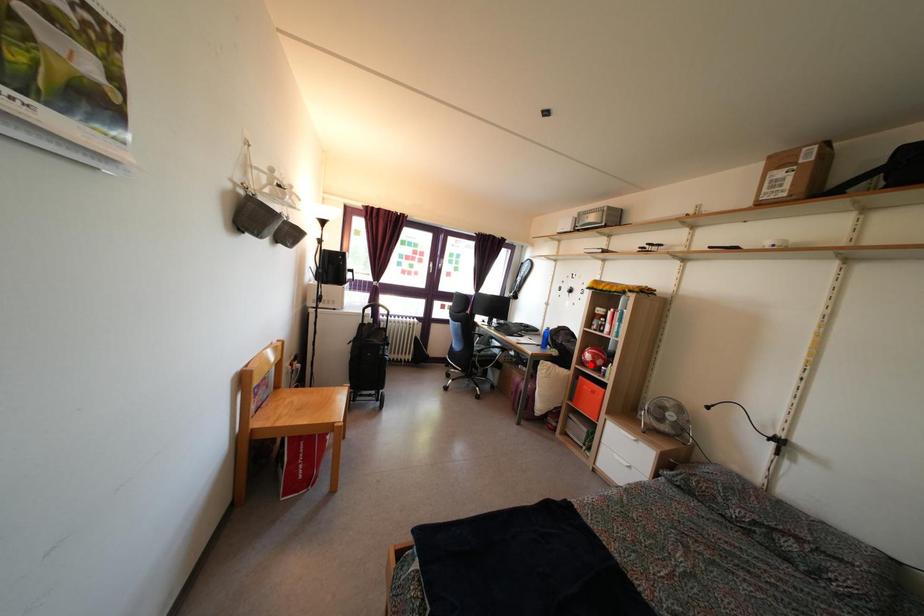
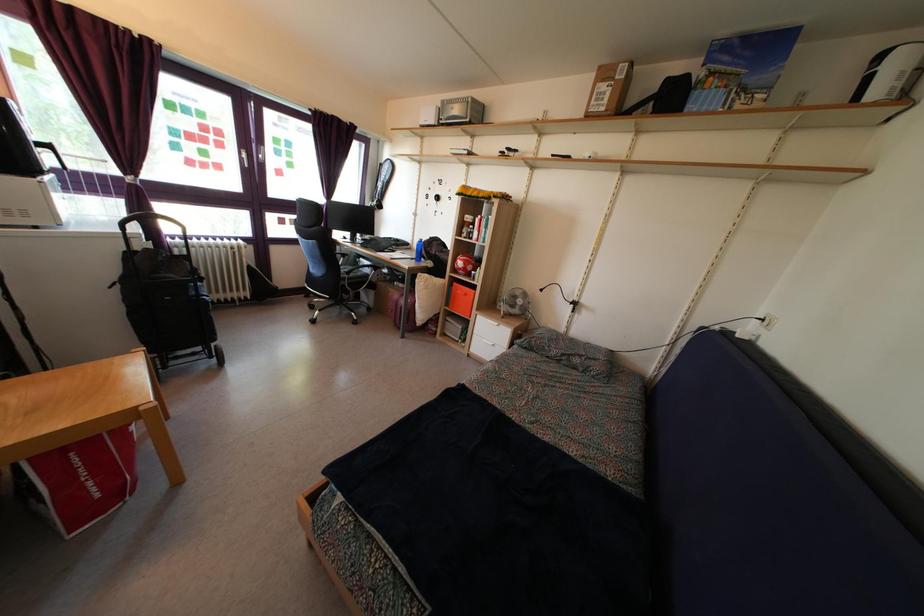
In the second image, find the point that corresponds to the highlighted location in the first image.

(463, 272)